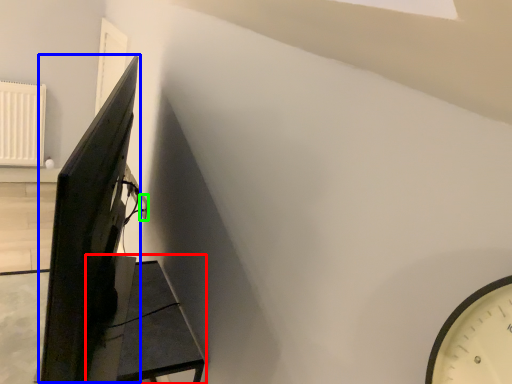
Question: Which object is the farthest from furniture (highlighted by a red box)? Choose among these: computer monitor (highlighted by a blue box) or electric outlet (highlighted by a green box).

Choices:
 (A) computer monitor
 (B) electric outlet

Answer: (B)